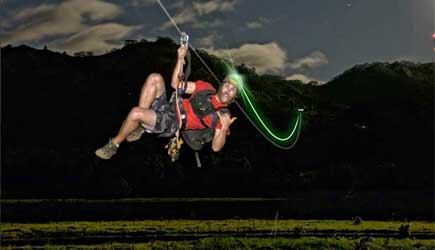
You are a GUI agent. You are given a task and a screenshot of the screen. Output one action in this format:
    pyautogui.click(x=<x>, y=<y>)
    Task: Click on the light
    Image resolution: width=435 pixels, height=250 pixels.
    Given the screenshot: What is the action you would take?
    pyautogui.click(x=235, y=76)